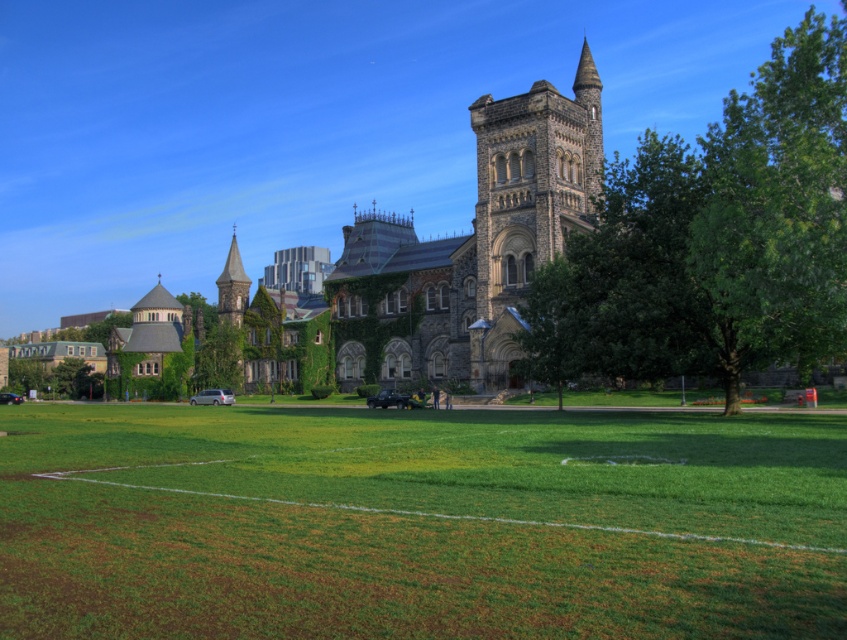
Is point (264, 420) farther from viewer compared to point (523, 131)?

No, (264, 420) is closer to viewer.

Is the position of green grass field at center more distant than that of stone church at center?

That is False.

Does point (319, 448) lie behind point (421, 355)?

No, it is in front of (421, 355).

Locate an element on the screen. This screenshot has width=847, height=640. green grass field at center is located at coordinates (418, 524).

Between green leafy tree at center-right and stone church at center, which one is positioned lower?

stone church at center is lower down.

Which is more to the right, green leafy tree at center-right or stone church at center?

Positioned to the right is green leafy tree at center-right.

Does point (796, 214) come in front of point (390, 257)?

Yes, it is in front of point (390, 257).

The image size is (847, 640). Find the location of `green leafy tree at center-right`. green leafy tree at center-right is located at coordinates (713, 237).

Is point (652, 502) farther from viewer compared to point (699, 198)?

No, it is in front of (699, 198).

Between point (573, 600) and point (805, 192), which one is positioned behind?

The point (805, 192) is more distant.

Does point (136, 627) come farther from viewer compared to point (678, 305)?

No, (136, 627) is closer to viewer.

Where is `green grass field at center`? This screenshot has width=847, height=640. green grass field at center is located at coordinates (418, 524).